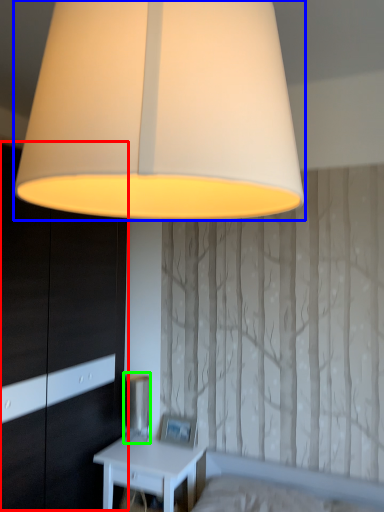
Question: Based on their relative distances, which object is farther from dresser (highlighted by a red box)? Choose from lamp (highlighted by a blue box) and table lamp (highlighted by a green box).

Choices:
 (A) lamp
 (B) table lamp

Answer: (A)